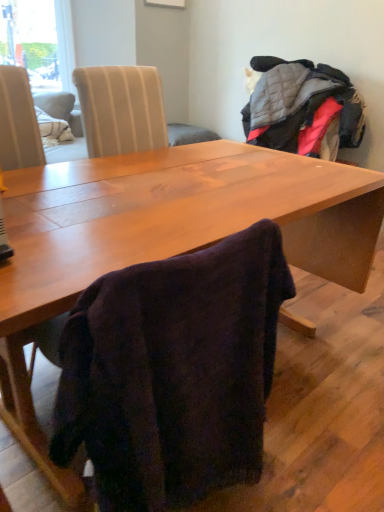
Question: Should I look upward or downward to see wooden table at center?

Choices:
 (A) down
 (B) up

Answer: (A)